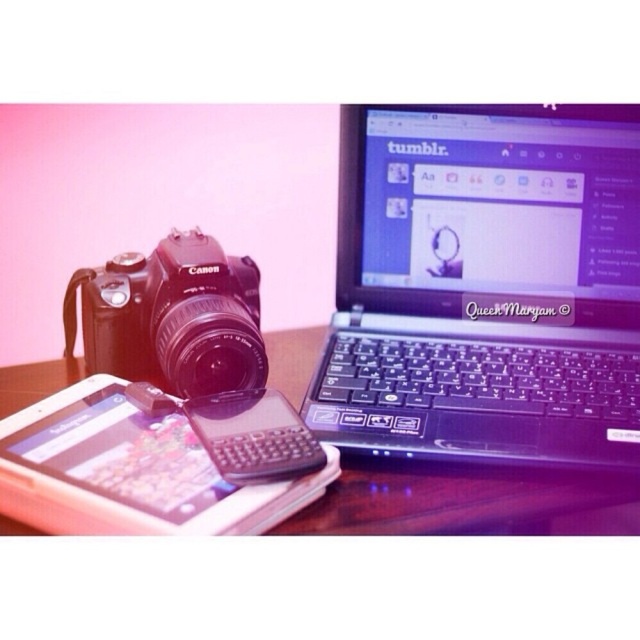
Which is below, white plastic tablet at lower left or black plastic smartphone at center?

white plastic tablet at lower left

Does white plastic tablet at lower left come behind black plastic smartphone at center?

No, white plastic tablet at lower left is closer to the viewer.

Image resolution: width=640 pixels, height=640 pixels. What are the coordinates of `white plastic tablet at lower left` in the screenshot? It's located at (131, 472).

Is black matte camera at left smaller than black plastic smartphone at center?

No, black matte camera at left is not smaller than black plastic smartphone at center.

In the scene shown: Between black matte camera at left and black plastic smartphone at center, which one appears on the right side from the viewer's perspective?

black plastic smartphone at center is more to the right.

Describe the element at coordinates (172, 317) in the screenshot. I see `black matte camera at left` at that location.

At what (x,y) coordinates should I click in order to perform the action: click on black matte camera at left. Please return your answer as a coordinate pair (x, y). Looking at the image, I should click on (172, 317).

What do you see at coordinates (484, 285) in the screenshot? I see `black plastic laptop at upper right` at bounding box center [484, 285].

Who is more forward, (604, 154) or (49, 497)?

Point (49, 497) is more forward.

This screenshot has width=640, height=640. In order to click on black plastic laptop at upper right in this screenshot , I will do `click(484, 285)`.